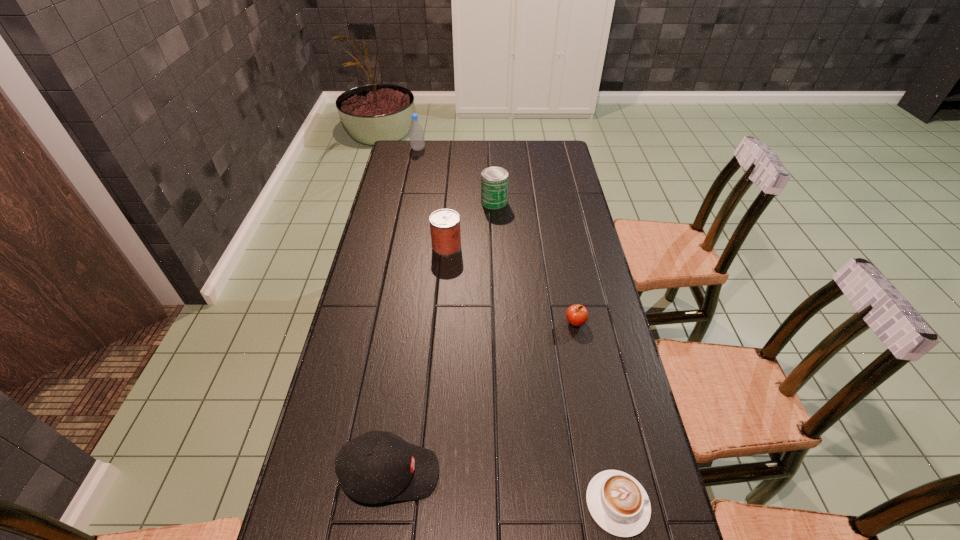
In order to click on bottle in this screenshot , I will do `click(416, 133)`.

Identify the location of the tallest object. The height and width of the screenshot is (540, 960). (416, 133).

This screenshot has height=540, width=960. Identify the location of the fifth nearest object. (494, 180).

Identify the location of the farther can. Image resolution: width=960 pixels, height=540 pixels. (494, 180).

The width and height of the screenshot is (960, 540). What are the coordinates of `the nearer can` in the screenshot? It's located at (445, 223).

Identify the location of the third farthest object. The image size is (960, 540). 445,223.

Where is `baseball cap`? This screenshot has width=960, height=540. baseball cap is located at coordinates (375, 467).

Locate an element on the screen. the third nearest object is located at coordinates [577, 315].

Identify the location of apple. This screenshot has width=960, height=540. (577, 315).

Locate an element on the screen. cappuccino is located at coordinates (617, 502).